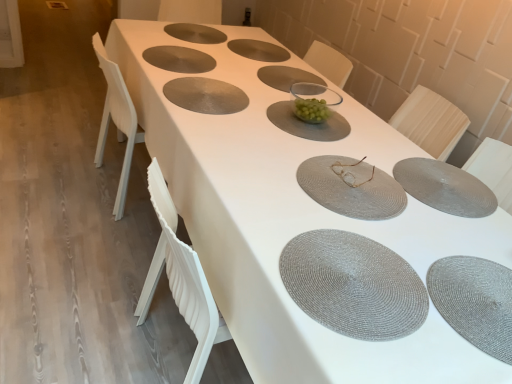
Identify the location of vacant area situated below gray woven placemat at center (from a real-world perspective). Image resolution: width=512 pixels, height=384 pixels. (283, 76).